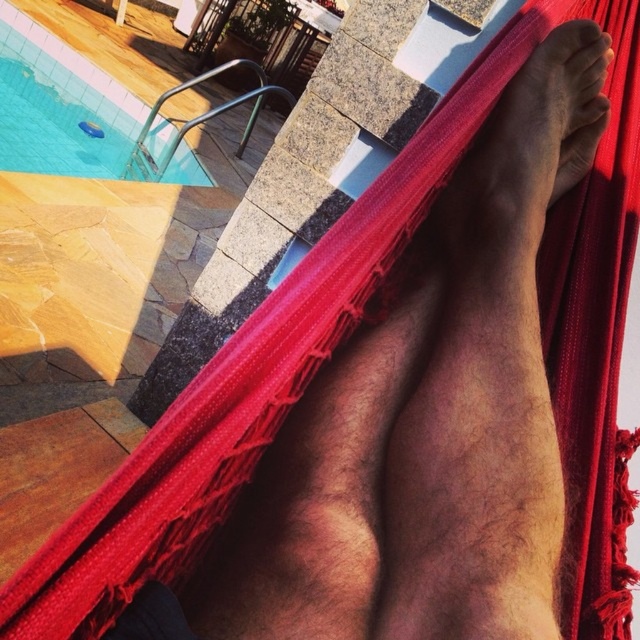
You are a lifeguard on duty and see the dark skin foot at upper right and the blue glossy water at upper left in your line of sight. Which object is positioned more to the right side of your view?

The dark skin foot at upper right is positioned more to the right side of your view than the blue glossy water at upper left.

You are a lifeguard standing at the edge of the pool. You need to reach the dark skin foot at upper right and the blue glossy water at upper left. Which one is farther from your current position?

The blue glossy water at upper left is farther from your current position because the distance between dark skin foot at upper right and blue glossy water at upper left is 4.80 meters, so whichever is farther depends on your position. Wait, the question states you are at the edge of the pool. The blue glossy water is at upper left, which is likely in the pool, so the foot is on the hammock outside. Therefore, the foot is farther from the pool edge than the water surface. Hence, the foot is farther.